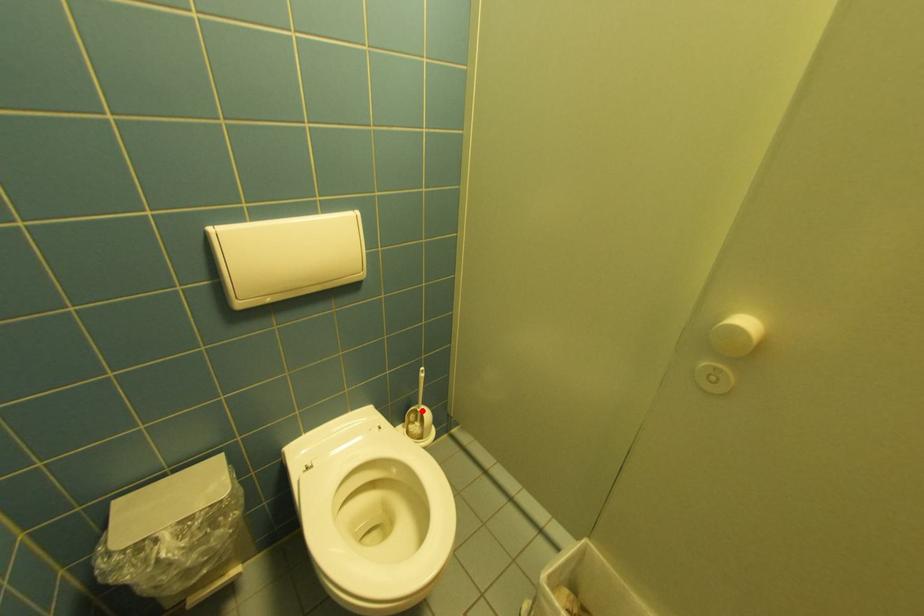
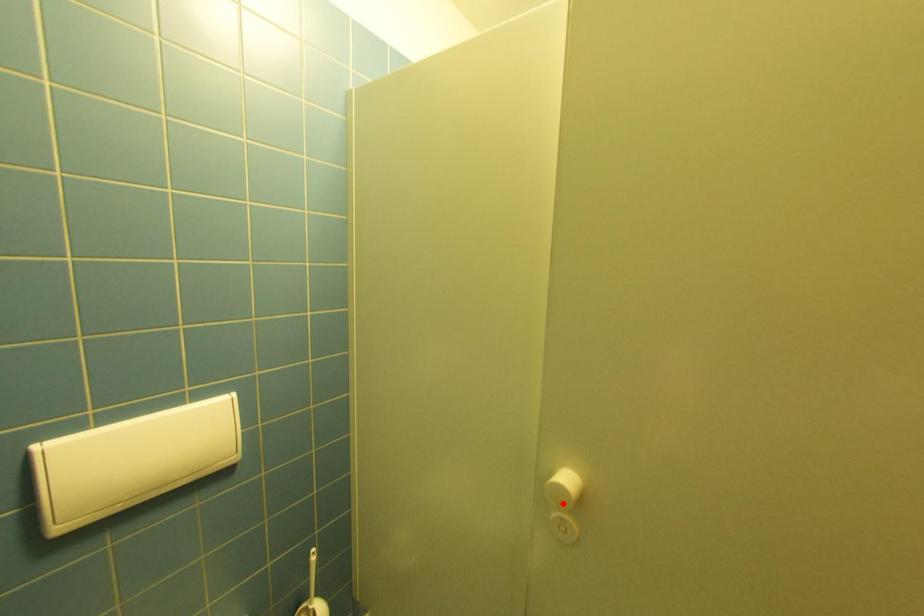
I am providing you with two images of the same scene from different viewpoints. A red point is marked on the first image and another point is marked on the second image. Does the point marked in image1 correspond to the same location as the one in image2?

No